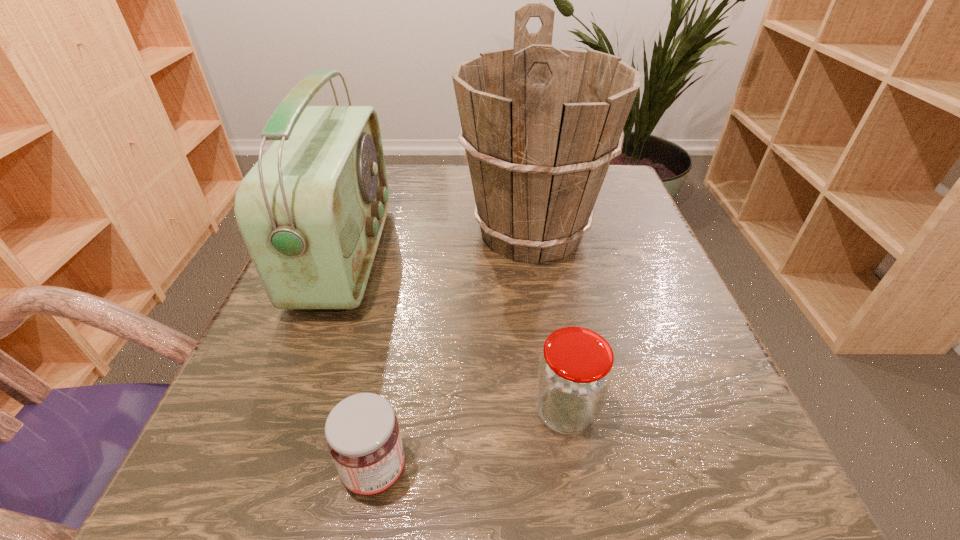
The image size is (960, 540). Find the location of `free space at the right edge of the desktop`. free space at the right edge of the desktop is located at coordinates (713, 391).

In the image, there is a desktop. Identify the location of vacant space at the far left corner. This screenshot has height=540, width=960. (393, 205).

Where is `vacant space at the far right corner of the desktop`? vacant space at the far right corner of the desktop is located at coordinates (623, 184).

Where is `free location at the near right corner of the desktop`? The image size is (960, 540). free location at the near right corner of the desktop is located at coordinates (703, 488).

Find the location of `vacant space that's between the jar and the bucket`. vacant space that's between the jar and the bucket is located at coordinates point(548,322).

The height and width of the screenshot is (540, 960). I want to click on free space that is in between the bucket and the jam, so click(453, 352).

What are the coordinates of `unoccupied area between the jam and the jar` in the screenshot? It's located at (470, 441).

The width and height of the screenshot is (960, 540). In order to click on free spot between the tallest object and the shortest object in this screenshot , I will do `click(453, 352)`.

At what (x,y) coordinates should I click in order to perform the action: click on free space between the tallest object and the radio receiver. Please return your answer as a coordinate pair (x, y). The width and height of the screenshot is (960, 540). Looking at the image, I should click on (439, 244).

This screenshot has width=960, height=540. Identify the location of vacant area that lies between the jar and the bucket. (548, 322).